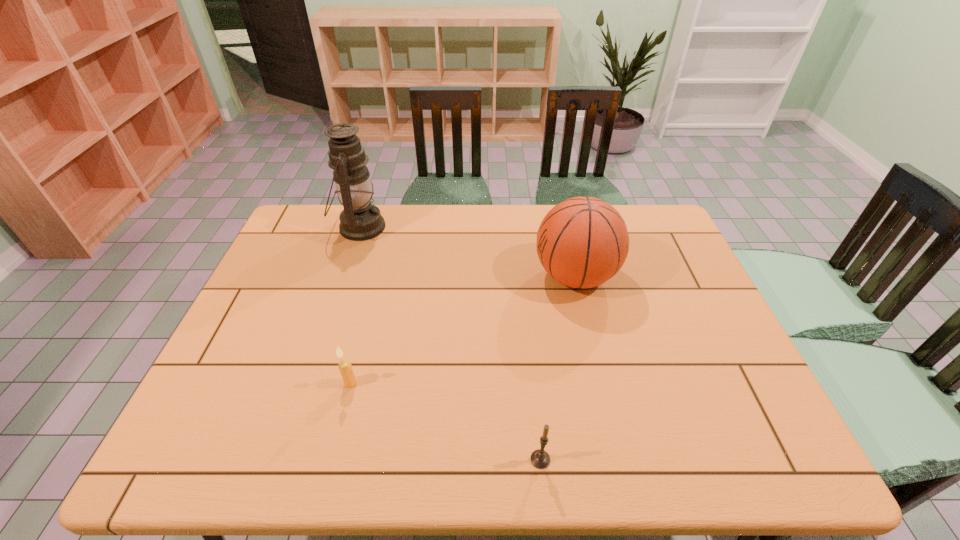
Identify the location of vacant space at the far left corner. The image size is (960, 540). (325, 218).

In the image, there is a desktop. Where is `vacant space at the far right corner`? vacant space at the far right corner is located at coordinates (653, 241).

Identify the location of free space that is in between the farthest object and the basketball. This screenshot has width=960, height=540. (468, 252).

Identify the location of free spot between the nearest object and the basketball. Image resolution: width=960 pixels, height=540 pixels. (558, 368).

In order to click on free point between the farthest object and the second nearest object in this screenshot , I will do pyautogui.click(x=355, y=305).

This screenshot has height=540, width=960. What are the coordinates of `free space between the nearest object and the rightmost object` in the screenshot? It's located at (558, 368).

Find the location of a particular element. This screenshot has height=540, width=960. free space between the basketball and the second object from right to left is located at coordinates (558, 368).

Find the location of a particular element. This screenshot has width=960, height=540. free space between the farthest object and the farther candle is located at coordinates (355, 305).

This screenshot has height=540, width=960. I want to click on empty space between the farthest object and the third object from left to right, so click(450, 343).

You are a GUI agent. You are given a task and a screenshot of the screen. Output one action in this format:
    pyautogui.click(x=<x>, y=<y>)
    Task: Click on the unoccupied area between the left candle and the farthest object
    The height and width of the screenshot is (540, 960).
    Given the screenshot: What is the action you would take?
    pyautogui.click(x=355, y=305)